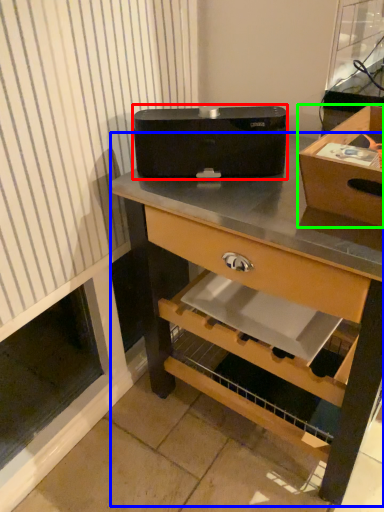
Question: Estimate the real-world distances between objects in this image. Which object is closer to appliance (highlighted by a red box), desk (highlighted by a blue box) or box (highlighted by a green box)?

Choices:
 (A) desk
 (B) box

Answer: (A)